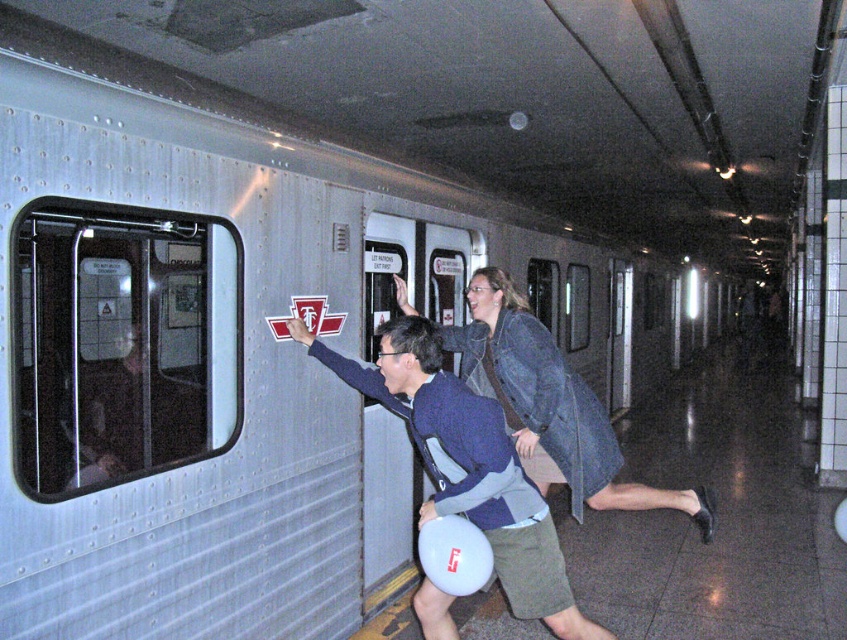
Can you confirm if blue fabric shirt at center is taller than denim jacket at center?

Incorrect, blue fabric shirt at center's height is not larger of denim jacket at center's.

What do you see at coordinates (468, 465) in the screenshot? Image resolution: width=847 pixels, height=640 pixels. I see `blue fabric shirt at center` at bounding box center [468, 465].

Find the location of a particular element. The image size is (847, 640). blue fabric shirt at center is located at coordinates (468, 465).